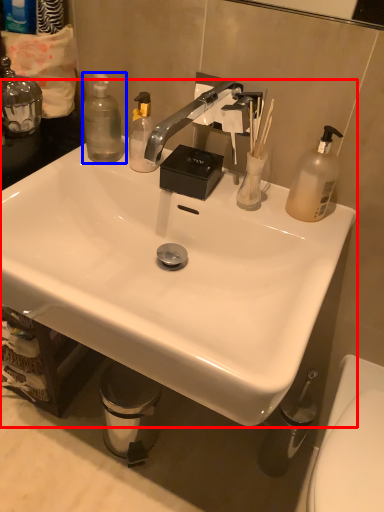
Question: Which point is further to the camera, sink (highlighted by a red box) or bottle (highlighted by a blue box)?

Choices:
 (A) sink
 (B) bottle

Answer: (B)